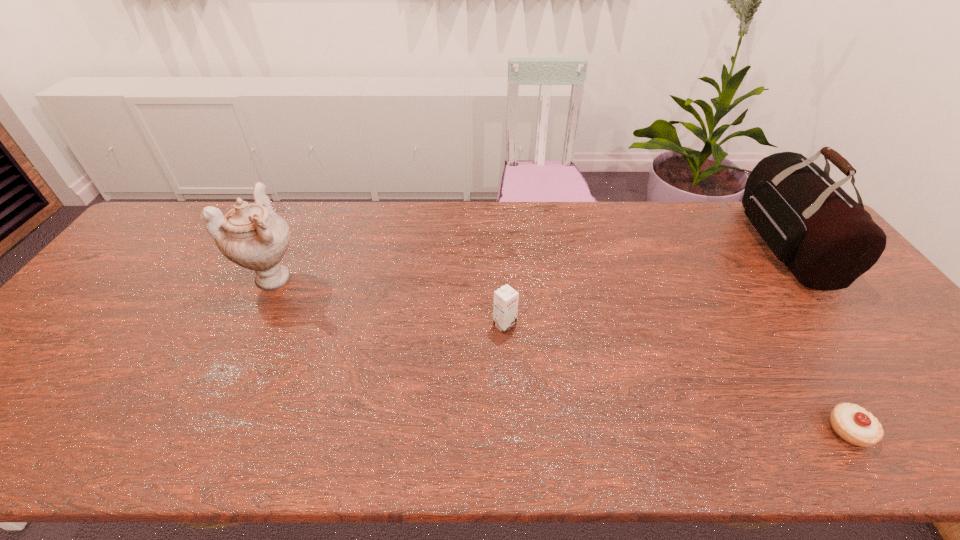
Identify the location of object that can be found as the third closest to the chocolate milk. The width and height of the screenshot is (960, 540). (826, 239).

Image resolution: width=960 pixels, height=540 pixels. Identify the location of object that is the closest to the duffel bag. (852, 423).

Locate an element on the screen. The width and height of the screenshot is (960, 540). vacant space that satisfies the following two spatial constraints: 1. on the front side of the second object from right to left; 2. on the right side of the leftmost object is located at coordinates (201, 430).

Image resolution: width=960 pixels, height=540 pixels. In order to click on vacant space that satisfies the following two spatial constraints: 1. on the front side of the third tallest object; 2. on the right side of the shortest object in this screenshot , I will do `click(510, 430)`.

Where is `vacant region that satisfies the following two spatial constraints: 1. on the front pocket of the rightmost object; 2. on the front side of the nearest object`? vacant region that satisfies the following two spatial constraints: 1. on the front pocket of the rightmost object; 2. on the front side of the nearest object is located at coordinates (927, 430).

The width and height of the screenshot is (960, 540). Find the location of `free space that satisfies the following two spatial constraints: 1. on the front side of the pastry; 2. on the left side of the third tallest object`. free space that satisfies the following two spatial constraints: 1. on the front side of the pastry; 2. on the left side of the third tallest object is located at coordinates (510, 430).

Where is `free region that satisfies the following two spatial constraints: 1. on the front side of the third tallest object; 2. on the right side of the leftmost object`? free region that satisfies the following two spatial constraints: 1. on the front side of the third tallest object; 2. on the right side of the leftmost object is located at coordinates (251, 325).